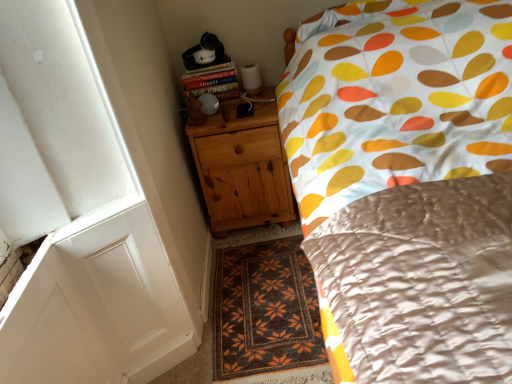
Where is `brown woven rug at center`? This screenshot has height=384, width=512. brown woven rug at center is located at coordinates (266, 313).

This screenshot has height=384, width=512. I want to click on hardcover book at upper left, so click(x=213, y=82).

Which is nearer, (309,370) or (186,89)?

The point (309,370) is closer.

Which object is wider, brown woven rug at center or hardcover book at upper left?

With larger width is brown woven rug at center.

Do you think brown woven rug at center is within hardcover book at upper left, or outside of it?

brown woven rug at center is not inside hardcover book at upper left, it's outside.

This screenshot has width=512, height=384. What are the coordinates of `book on the left of brown woven rug at center` in the screenshot? It's located at (213, 82).

Is hardcover book at upper left oriented away from brown woven rug at center?

No, hardcover book at upper left is not facing away from brown woven rug at center.

Looking at their sizes, would you say hardcover book at upper left is wider or thinner than brown woven rug at center?

In the image, hardcover book at upper left appears to be more narrow than brown woven rug at center.

Which point is more distant from viewer, (x=198, y=92) or (x=246, y=281)?

Point (x=198, y=92)

Considering the relative positions of brown woven rug at center and natural wood chest of drawers at lower left in the image provided, is brown woven rug at center to the left or to the right of natural wood chest of drawers at lower left?

From the image, it's evident that brown woven rug at center is to the right of natural wood chest of drawers at lower left.

From the picture: From a real-world perspective, between brown woven rug at center and natural wood chest of drawers at lower left, who is vertically lower?

From a 3D spatial view, brown woven rug at center is below.

In the image, is brown woven rug at center positioned in front of or behind natural wood chest of drawers at lower left?

Clearly, brown woven rug at center is in front of natural wood chest of drawers at lower left.

Would you say brown woven rug at center is a long distance from natural wood chest of drawers at lower left?

Actually, brown woven rug at center and natural wood chest of drawers at lower left are a little close together.

What's the angular difference between natural wood chest of drawers at lower left and brown woven rug at center's facing directions?

The angle between the facing direction of natural wood chest of drawers at lower left and the facing direction of brown woven rug at center is 0.891 degrees.

Is natural wood chest of drawers at lower left aimed at brown woven rug at center?

Yes, natural wood chest of drawers at lower left is aimed at brown woven rug at center.

Can you confirm if natural wood chest of drawers at lower left is taller than brown woven rug at center?

Indeed, natural wood chest of drawers at lower left has a greater height compared to brown woven rug at center.

Which object is closer to the camera, natural wood chest of drawers at lower left or brown woven rug at center?

brown woven rug at center is closer to the camera.

From a real-world perspective, is natural wood chest of drawers at lower left located beneath hardcover book at upper left?

Indeed, from a real-world perspective, natural wood chest of drawers at lower left is positioned beneath hardcover book at upper left.

Is hardcover book at upper left at the back of natural wood chest of drawers at lower left?

natural wood chest of drawers at lower left is not turned away from hardcover book at upper left.

Is hardcover book at upper left completely or partially inside natural wood chest of drawers at lower left?

That's incorrect, hardcover book at upper left is not inside natural wood chest of drawers at lower left.

From a real-world perspective, which object stands above the other?

hardcover book at upper left.

Is hardcover book at upper left taller than natural wood chest of drawers at lower left?

No.

Looking at their sizes, would you say hardcover book at upper left is wider or thinner than natural wood chest of drawers at lower left?

In the image, hardcover book at upper left appears to be more narrow than natural wood chest of drawers at lower left.

At what (x,y) coordinates should I click in order to perform the action: click on doormat below the hardcover book at upper left (from a real-world perspective). Please return your answer as a coordinate pair (x, y). Looking at the image, I should click on (266, 313).

The height and width of the screenshot is (384, 512). Find the location of `doormat in front of the hardcover book at upper left`. doormat in front of the hardcover book at upper left is located at coordinates (266, 313).

When comparing their distances from brown woven rug at center, does hardcover book at upper left or natural wood chest of drawers at lower left seem further?

Among the two, hardcover book at upper left is located further to brown woven rug at center.

Estimate the real-world distances between objects in this image. Which object is further from hardcover book at upper left, brown woven rug at center or natural wood chest of drawers at lower left?

brown woven rug at center is further to hardcover book at upper left.

Looking at the image, which one is located closer to hardcover book at upper left, natural wood chest of drawers at lower left or brown woven rug at center?

The object closer to hardcover book at upper left is natural wood chest of drawers at lower left.

Considering their positions, is brown woven rug at center positioned closer to natural wood chest of drawers at lower left than hardcover book at upper left?

The object closer to natural wood chest of drawers at lower left is hardcover book at upper left.

When comparing their distances from brown woven rug at center, does natural wood chest of drawers at lower left or hardcover book at upper left seem further?

The object further to brown woven rug at center is hardcover book at upper left.

From the image, which object appears to be nearer to natural wood chest of drawers at lower left, hardcover book at upper left or brown woven rug at center?

A: Based on the image, hardcover book at upper left appears to be nearer to natural wood chest of drawers at lower left.

I want to click on the chest of drawers between hardcover book at upper left and brown woven rug at center vertically, so click(242, 169).